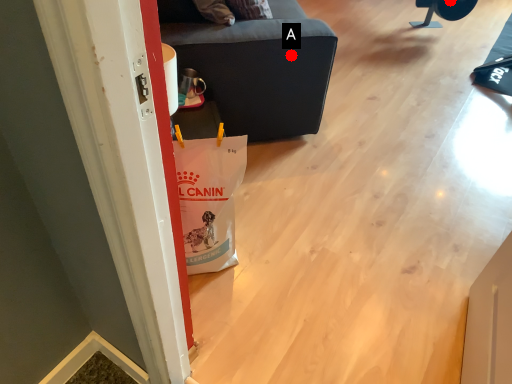
Question: Two points are circled on the image, labeled by A and B beside each circle. Which point is farther to the camera?

Choices:
 (A) A is further
 (B) B is further

Answer: (B)